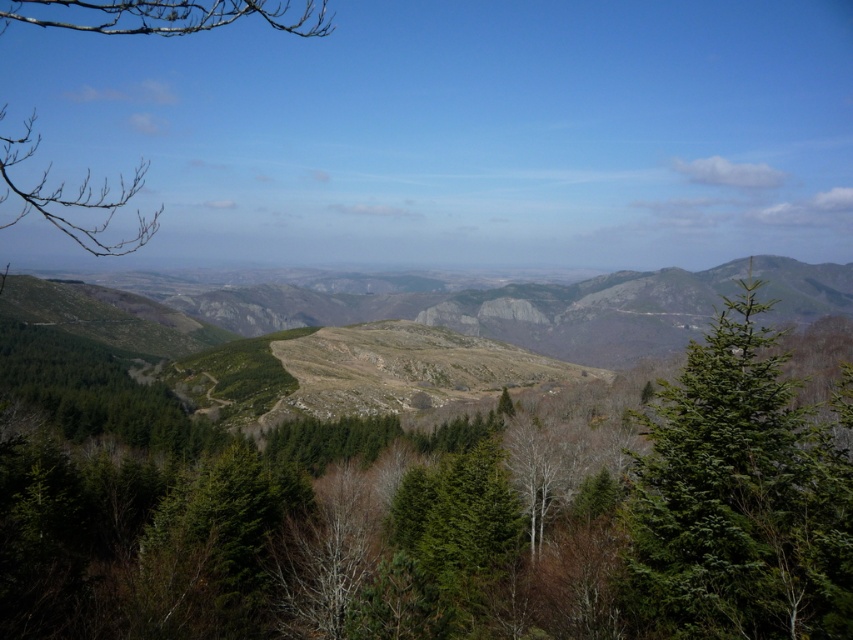
Does rugged stone mountain at center have a greater width compared to bare branches at upper left?

Correct, the width of rugged stone mountain at center exceeds that of bare branches at upper left.

Does point (706, 285) come in front of point (199, 28)?

No, (706, 285) is further to viewer.

Describe the element at coordinates (399, 312) in the screenshot. This screenshot has height=640, width=853. I see `rugged stone mountain at center` at that location.

Where is `rugged stone mountain at center`? This screenshot has width=853, height=640. rugged stone mountain at center is located at coordinates (399, 312).

Is point (728, 464) behind point (227, 307)?

No.

Who is taller, green matte tree at center or rugged stone mountain at center?

With more height is rugged stone mountain at center.

This screenshot has height=640, width=853. I want to click on green matte tree at center, so click(407, 484).

Which of these two, green matte tree at center or bare branches at upper left, stands taller?

bare branches at upper left

Measure the distance from green matte tree at center to bare branches at upper left.

green matte tree at center is 132.89 meters from bare branches at upper left.

Where is `green matte tree at center`? The image size is (853, 640). green matte tree at center is located at coordinates (407, 484).

This screenshot has height=640, width=853. In order to click on green matte tree at center in this screenshot , I will do `click(407, 484)`.